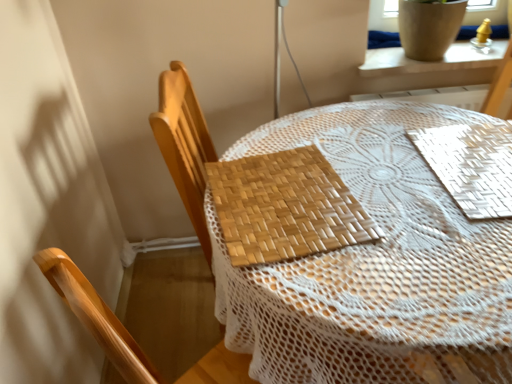
You are a GUI agent. You are given a task and a screenshot of the screen. Output one action in this format:
    pyautogui.click(x=<x>, y=<y>)
    Task: Click on the blank space situated above bamboo placemat at center (from a real-world perspective)
    The image size is (512, 384).
    Given the screenshot: What is the action you would take?
    pyautogui.click(x=377, y=201)